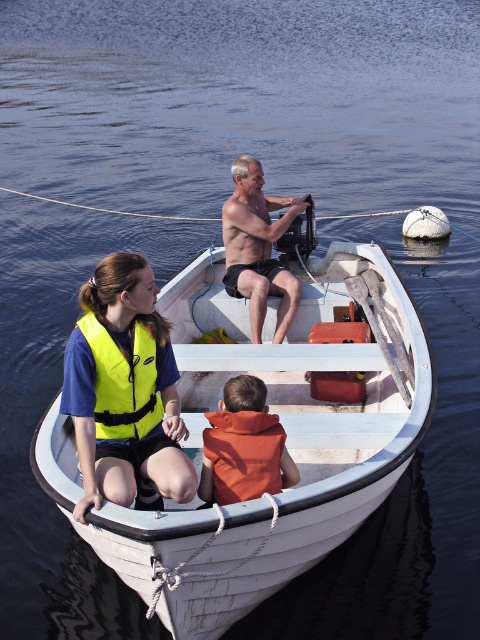
You are a safety inspector checking the distance between the white wood boat at center and the orange life vest at center. According to regulations, the maximum allowed distance between a boat and its life vest is 25 inches. Is this boat compliant with the safety regulations?

The white wood boat at center and orange life vest at center are 27.05 inches apart from each other, which exceeds the maximum allowed distance of 25 inches. Therefore, this boat is not compliant with the safety regulations.

You are standing on the dock and want to board the white wood boat at center. The dock has a wooden platform that is 3.5 meters long. Can you safely walk from the dock to the boat without needing to jump?

The distance between you and the white wood boat at center is 3.93 meters, which is slightly longer than the 3.5 meters dock. Therefore, you might need to make a small jump to reach the boat safely.